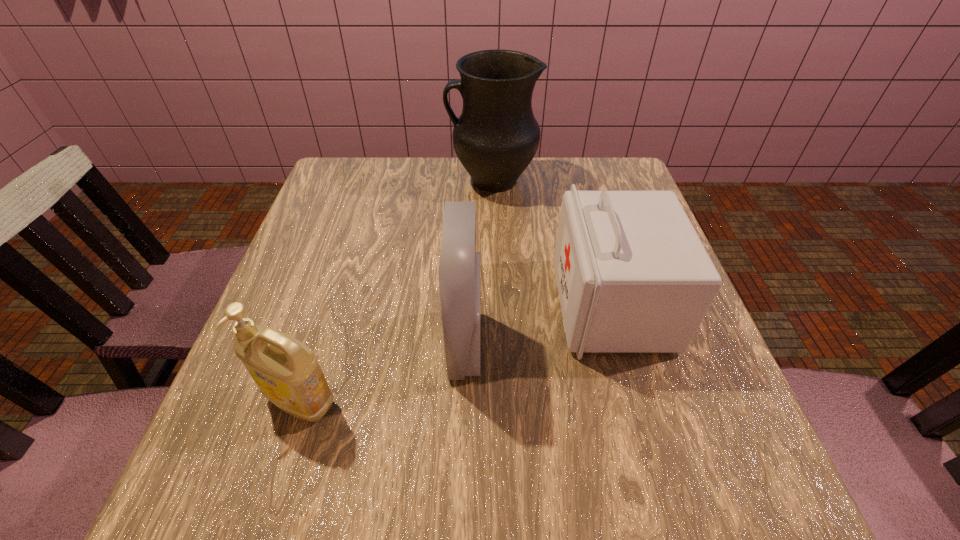
Identify the location of empty space that is in between the detergent and the pitcher. (396, 291).

This screenshot has height=540, width=960. I want to click on unoccupied position between the farthest object and the right first-aid kit, so click(551, 243).

The image size is (960, 540). In order to click on vacant space that's between the farthest object and the detergent in this screenshot , I will do pyautogui.click(x=396, y=291).

At what (x,y) coordinates should I click in order to perform the action: click on free space between the right first-aid kit and the farthest object. Please return your answer as a coordinate pair (x, y). The width and height of the screenshot is (960, 540). Looking at the image, I should click on (551, 243).

Identify which object is located as the second nearest to the leftmost object. Please provide its 2D coordinates. Your answer should be formatted as a tuple, i.e. [(x, y)], where the tuple contains the x and y coordinates of a point satisfying the conditions above.

[(633, 276)]

Find the location of a particular element. This screenshot has height=540, width=960. object that is the second closest to the farthest object is located at coordinates (459, 267).

At what (x,y) coordinates should I click in order to perform the action: click on free location that satisfies the following two spatial constraints: 1. on the handle side of the farthest object; 2. on the front side of the leftmost object. Please return your answer as a coordinate pair (x, y). Looking at the image, I should click on (499, 402).